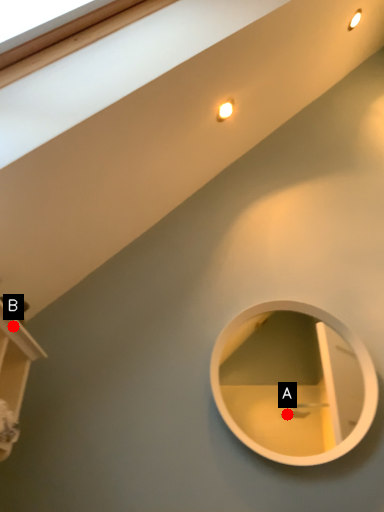
Question: Two points are circled on the image, labeled by A and B beside each circle. Which point appears farthest from the camera in this image?

Choices:
 (A) A is further
 (B) B is further

Answer: (A)